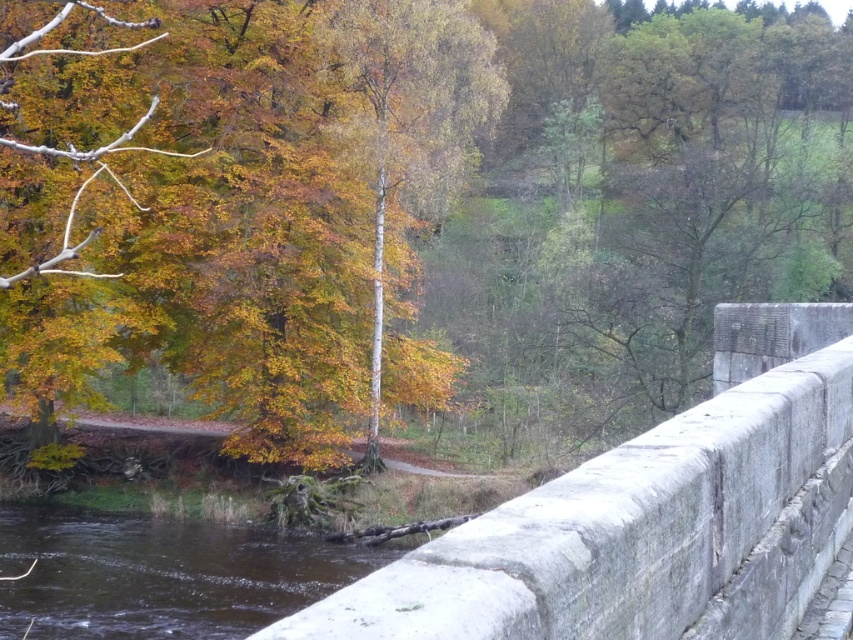
Question: Observing the image, what is the correct spatial positioning of gray stone bridge at center in reference to brown/rough wood at lower left?

Choices:
 (A) left
 (B) right

Answer: (B)

Question: Among these points, which one is farthest from the camera?

Choices:
 (A) [x=323, y=572]
 (B) [x=672, y=600]

Answer: (A)

Question: Which object is closer to the camera taking this photo?

Choices:
 (A) brown/rough wood at lower left
 (B) gray stone bridge at center

Answer: (B)

Question: Among these objects, which one is nearest to the camera?

Choices:
 (A) gray stone bridge at center
 (B) brown/rough wood at lower left

Answer: (A)

Question: Is gray stone bridge at center below brown/rough wood at lower left?

Choices:
 (A) no
 (B) yes

Answer: (A)

Question: Does gray stone bridge at center have a lesser width compared to brown/rough wood at lower left?

Choices:
 (A) no
 (B) yes

Answer: (B)